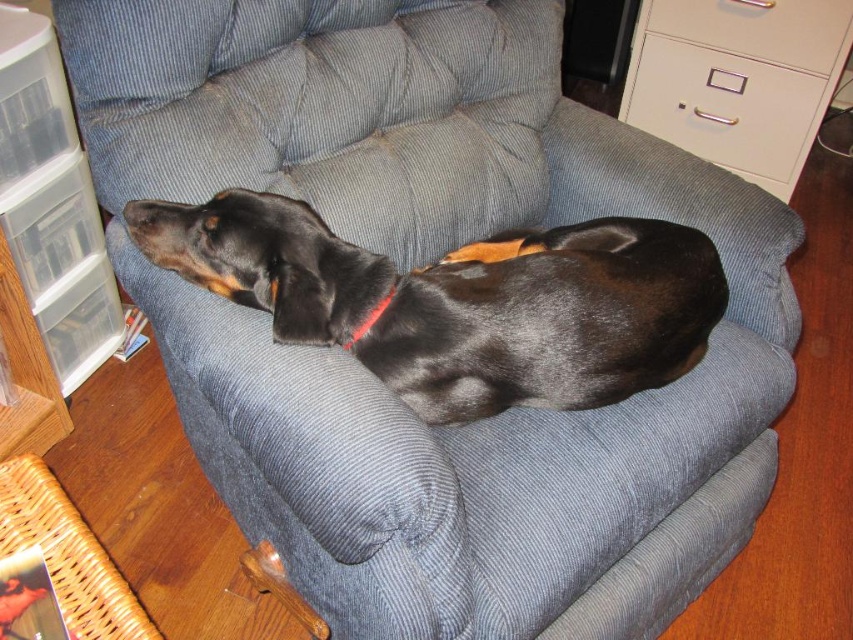
Consider the image. Does metallic gray file cabinet at upper right have a greater height compared to red fabric neckband at center?

Yes, metallic gray file cabinet at upper right is taller than red fabric neckband at center.

How far apart are metallic gray file cabinet at upper right and red fabric neckband at center?

They are 1.64 meters apart.

Who is more distant from viewer, [643,20] or [383,307]?

The point [643,20] is more distant.

Identify the location of metallic gray file cabinet at upper right. The height and width of the screenshot is (640, 853). (737, 80).

Who is higher up, black smooth dog at center or white plastic drawer at upper right?

Positioned higher is white plastic drawer at upper right.

In the scene shown: Measure the distance between black smooth dog at center and camera.

99.62 centimeters

Image resolution: width=853 pixels, height=640 pixels. What do you see at coordinates (460, 301) in the screenshot? I see `black smooth dog at center` at bounding box center [460, 301].

What are the coordinates of `black smooth dog at center` in the screenshot? It's located at (460, 301).

Is black smooth dog at center positioned behind red fabric neckband at center?

No, it is in front of red fabric neckband at center.

Which is above, black smooth dog at center or red fabric neckband at center?

Positioned higher is black smooth dog at center.

Identify the location of black smooth dog at center. (460, 301).